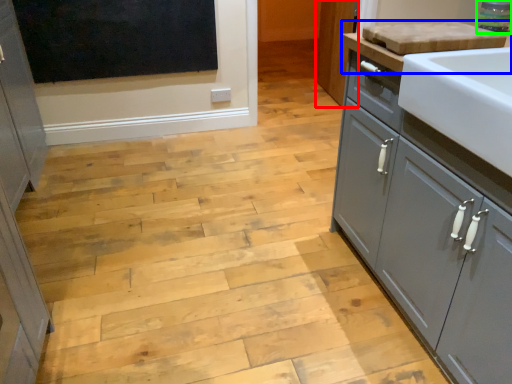
Question: Estimate the real-world distances between objects in this image. Which object is closer to cabinetry (highlighted by a red box), countertop (highlighted by a blue box) or appliance (highlighted by a green box)?

Choices:
 (A) countertop
 (B) appliance

Answer: (B)